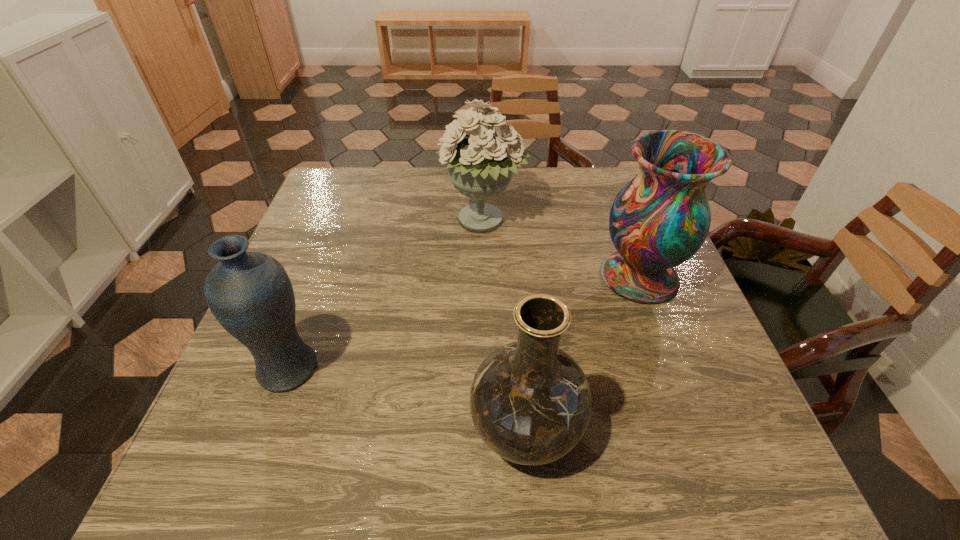
Locate an element on the screen. Image resolution: width=960 pixels, height=540 pixels. free space between the second vase from right to left and the leftmost object is located at coordinates (407, 399).

Locate an element on the screen. This screenshot has width=960, height=540. blank region between the third nearest object and the farthest object is located at coordinates (561, 249).

The width and height of the screenshot is (960, 540). In order to click on empty space that is in between the second vase from right to left and the bouquet in this screenshot , I will do `click(504, 326)`.

Image resolution: width=960 pixels, height=540 pixels. In order to click on vacant region between the second vase from right to left and the rightmost vase in this screenshot , I will do `click(583, 353)`.

I want to click on free spot between the farthest vase and the second vase from left to right, so click(x=583, y=353).

What are the coordinates of `blank region between the farthest object and the leftmost object` in the screenshot? It's located at (386, 295).

Locate an element on the screen. This screenshot has height=540, width=960. free space between the farthest vase and the leftmost object is located at coordinates (464, 323).

Identify the location of free space between the leftmost vase and the farthest vase. (464, 323).

Find the location of a particular element. vacant area that lies between the farthest object and the second vase from right to left is located at coordinates (504, 326).

Identify which object is the nearest to the leftmost object. Please provide its 2D coordinates. Your answer should be formatted as a tuple, i.e. [(x, y)], where the tuple contains the x and y coordinates of a point satisfying the conditions above.

[(531, 403)]